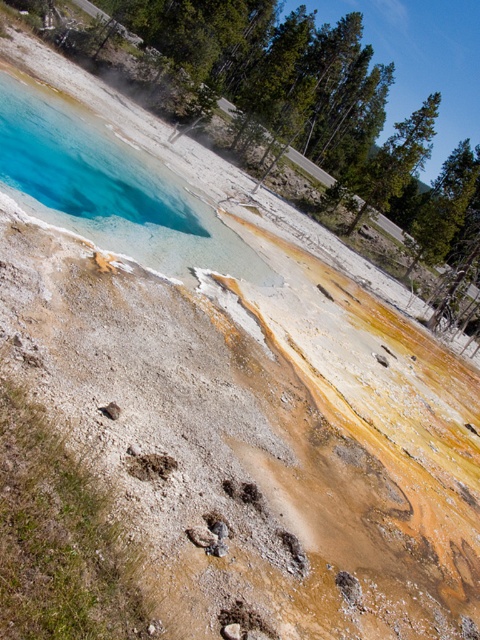
Question: Does blue translucent pool at upper left appear over brown sandy footprint at lower center?

Choices:
 (A) no
 (B) yes

Answer: (B)

Question: Does blue translucent pool at upper left appear on the left side of brown sandy footprint at lower center?

Choices:
 (A) yes
 (B) no

Answer: (A)

Question: Is blue translucent pool at upper left wider than brown sandy footprint at lower center?

Choices:
 (A) no
 (B) yes

Answer: (B)

Question: Among these objects, which one is nearest to the camera?

Choices:
 (A) blue translucent pool at upper left
 (B) brown sandy footprint at lower center

Answer: (B)